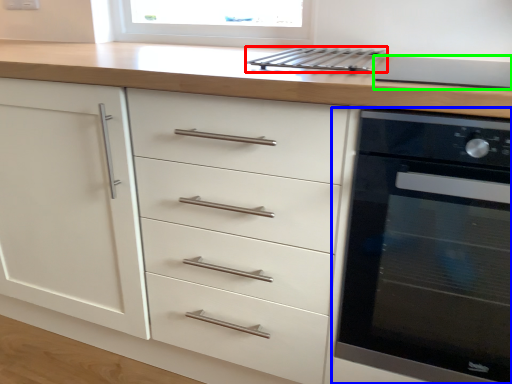
Question: Which object is the closest to the kitchen appliance (highlighted by a red box)? Choose among these: home appliance (highlighted by a blue box) or appliance (highlighted by a green box).

Choices:
 (A) home appliance
 (B) appliance

Answer: (B)